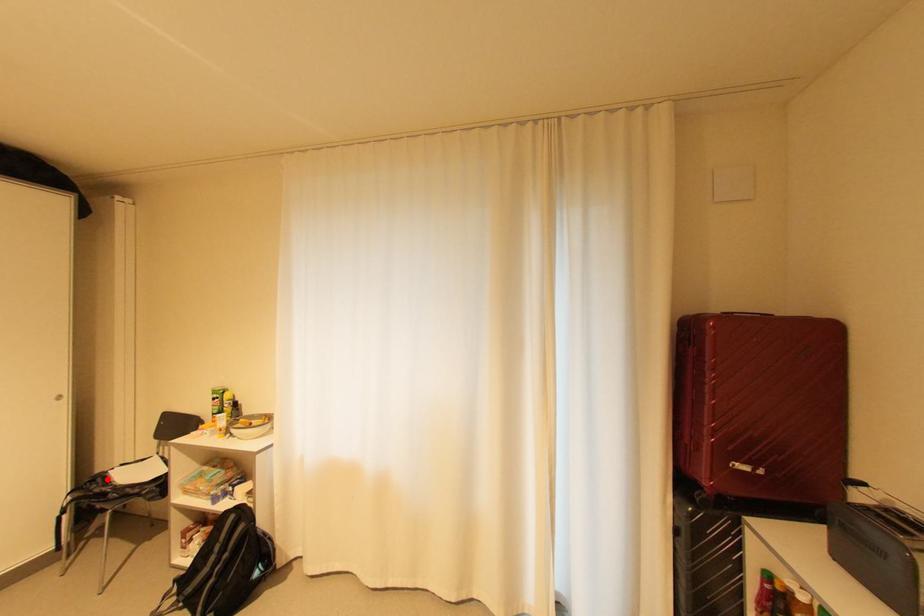
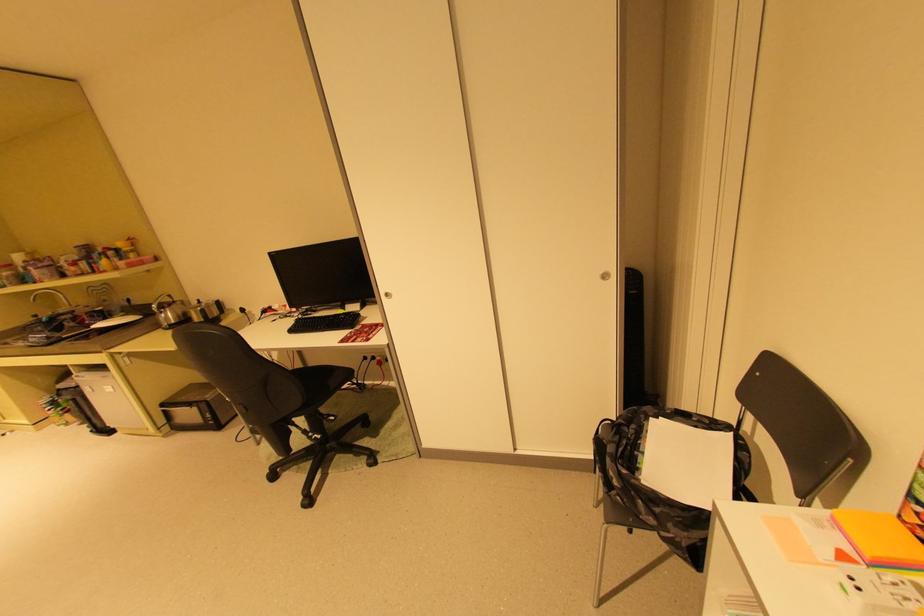
In the second image, find the point that corresponds to the highlighted location in the first image.

(640, 427)